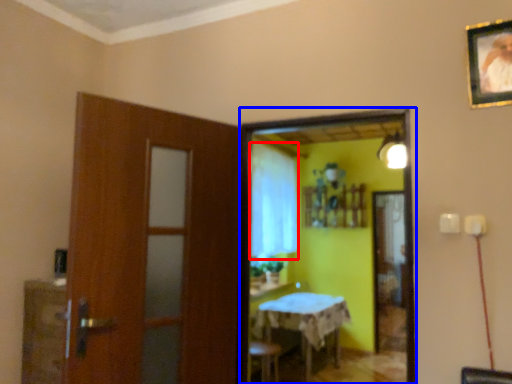
Question: Which point is closer to the camera, curtain (highlighted by a red box) or mirror (highlighted by a blue box)?

Choices:
 (A) curtain
 (B) mirror

Answer: (B)